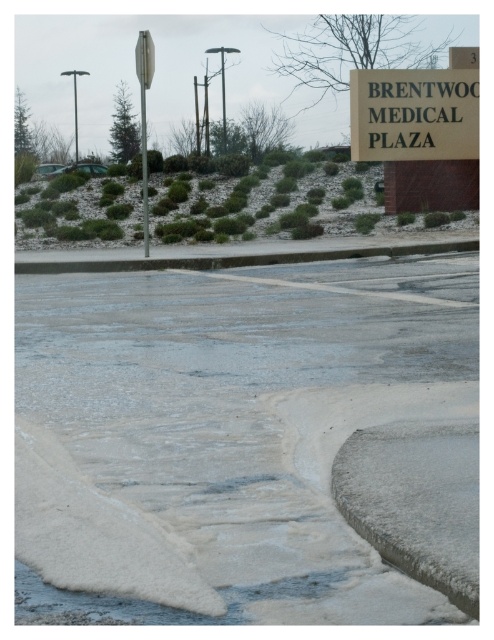
Which is above, white plastic sign at upper center or metallic reflective street sign at upper center?

Positioned higher is metallic reflective street sign at upper center.

Does white plastic sign at upper center have a lesser width compared to metallic reflective street sign at upper center?

Indeed, white plastic sign at upper center has a lesser width compared to metallic reflective street sign at upper center.

I want to click on white plastic sign at upper center, so click(413, 115).

Find the location of a particular element. This screenshot has height=640, width=494. white plastic sign at upper center is located at coordinates (413, 115).

Who is more forward, [362,90] or [143,93]?

Point [362,90] is more forward.

Is white plastic sign at upper center to the right of metallic pole at center from the viewer's perspective?

Indeed, white plastic sign at upper center is positioned on the right side of metallic pole at center.

Is point (477, 132) positioned after point (141, 129)?

That is False.

Identify the location of white plastic sign at upper center. Image resolution: width=494 pixels, height=640 pixels. (413, 115).

Is white frosted puddle at lower center below white plastic sign at upper center?

Yes, white frosted puddle at lower center is below white plastic sign at upper center.

Locate an element on the screen. The width and height of the screenshot is (494, 640). white frosted puddle at lower center is located at coordinates (246, 417).